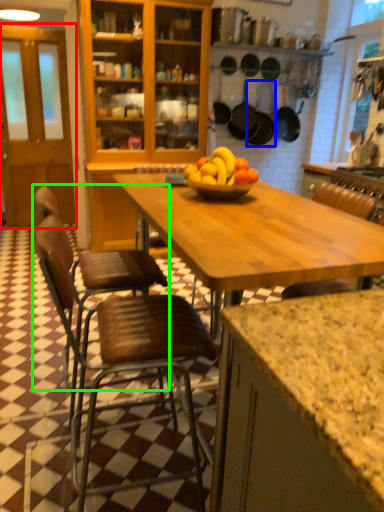
Question: Which object is positioned closest to glass door (highlighted by a red box)? Select from frying pan (highlighted by a blue box) and chair (highlighted by a green box).

Choices:
 (A) frying pan
 (B) chair

Answer: (A)